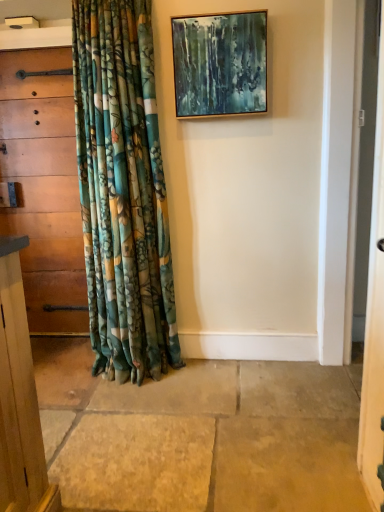
I want to click on free location above wooden picture frame at upper center (from a real-world perspective), so click(x=215, y=12).